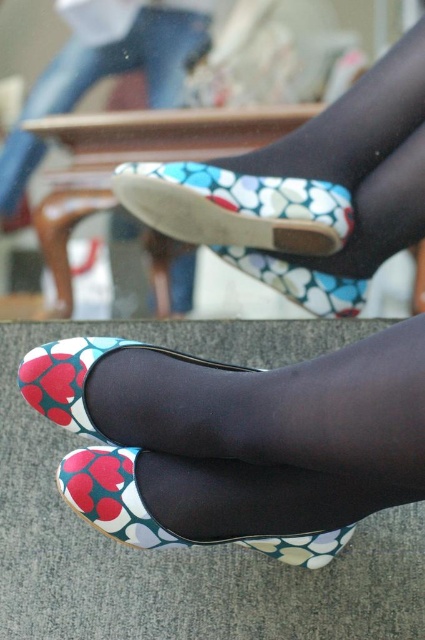
Question: Does floral fabric shoe at center appear on the right side of matte floral shoe at upper center?

Choices:
 (A) yes
 (B) no

Answer: (A)

Question: Is floral fabric shoe at center positioned at the back of matte floral shoe at center?

Choices:
 (A) yes
 (B) no

Answer: (A)

Question: Estimate the real-world distances between objects in this image. Which object is farther from the matte floral shoe at center?

Choices:
 (A) floral fabric shoe at center
 (B) matte floral shoe at upper center

Answer: (B)

Question: Which object is closer to the camera taking this photo?

Choices:
 (A) matte floral shoe at upper center
 (B) matte floral shoe at center
 (C) floral fabric shoe at center

Answer: (B)

Question: Can you confirm if floral fabric shoe at center is positioned below matte floral shoe at center?

Choices:
 (A) yes
 (B) no

Answer: (B)

Question: Which object appears closest to the camera in this image?

Choices:
 (A) matte floral shoe at upper center
 (B) matte floral shoe at center

Answer: (B)